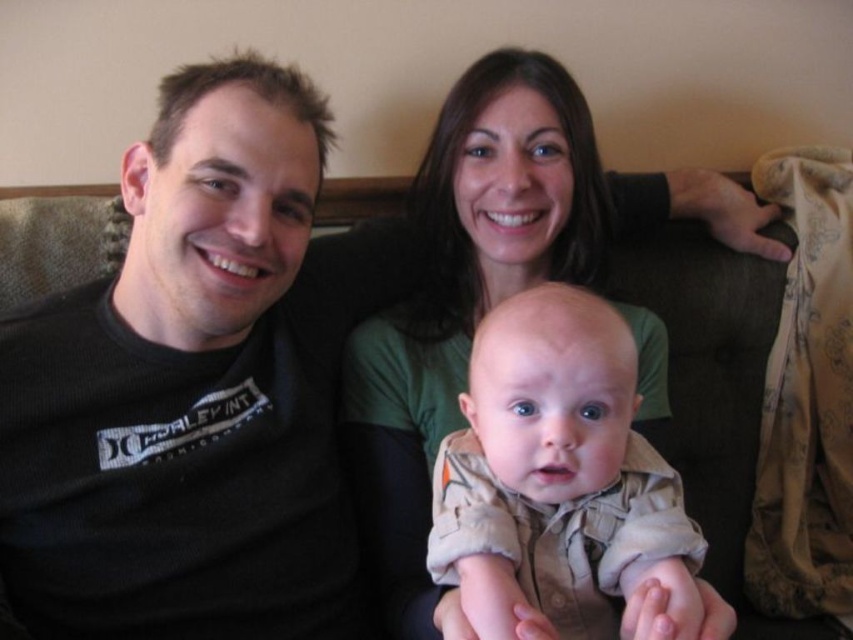
Question: Can you confirm if black cotton t-shirt at left is bigger than brown fabric couch at center?

Choices:
 (A) yes
 (B) no

Answer: (B)

Question: Is black cotton t-shirt at left positioned before brown fabric couch at center?

Choices:
 (A) no
 (B) yes

Answer: (B)

Question: Among these objects, which one is farthest from the camera?

Choices:
 (A) tan cotton onesie at center
 (B) black cotton t-shirt at left
 (C) green matte shirt at center
 (D) brown fabric couch at center

Answer: (D)

Question: Which point is closer to the camera taking this photo?

Choices:
 (A) (549, 454)
 (B) (416, 598)

Answer: (A)

Question: Which of these objects is positioned closest to the black cotton t-shirt at left?

Choices:
 (A) green matte shirt at center
 (B) brown fabric couch at center

Answer: (B)

Question: Can you confirm if black cotton t-shirt at left is positioned to the left of green matte shirt at center?

Choices:
 (A) no
 (B) yes

Answer: (B)